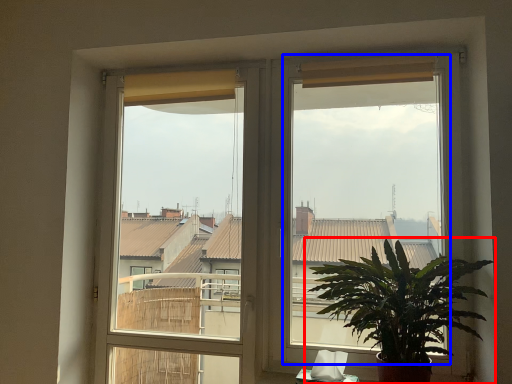
Question: Which point is further to the camera, houseplant (highlighted by a red box) or window screen (highlighted by a blue box)?

Choices:
 (A) houseplant
 (B) window screen

Answer: (B)